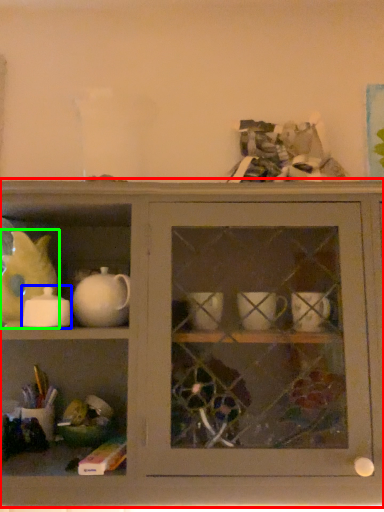
Question: Estimate the real-world distances between objects in this image. Which object is closer to shelf (highlighted by a red box), tableware (highlighted by a blue box) or animal (highlighted by a green box)?

Choices:
 (A) tableware
 (B) animal

Answer: (A)